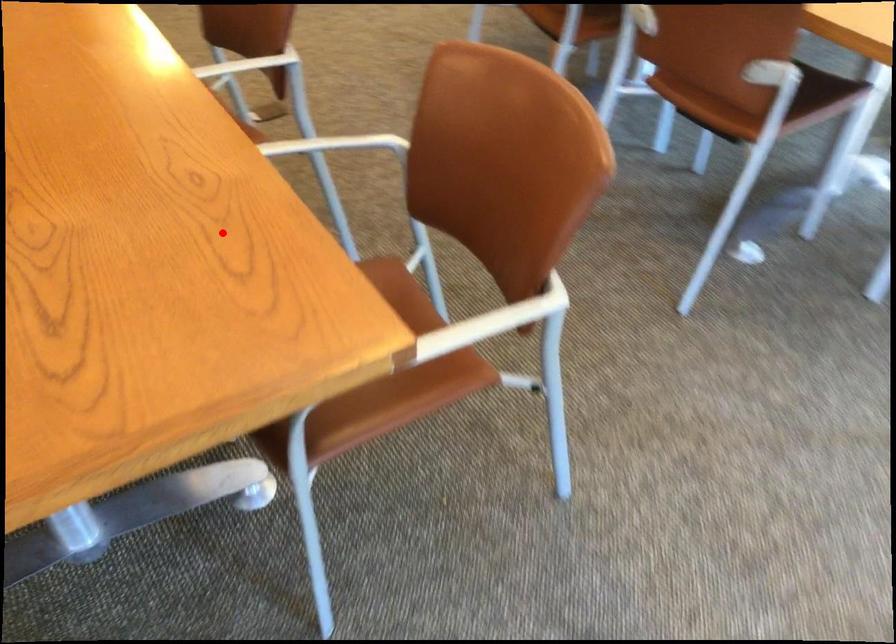
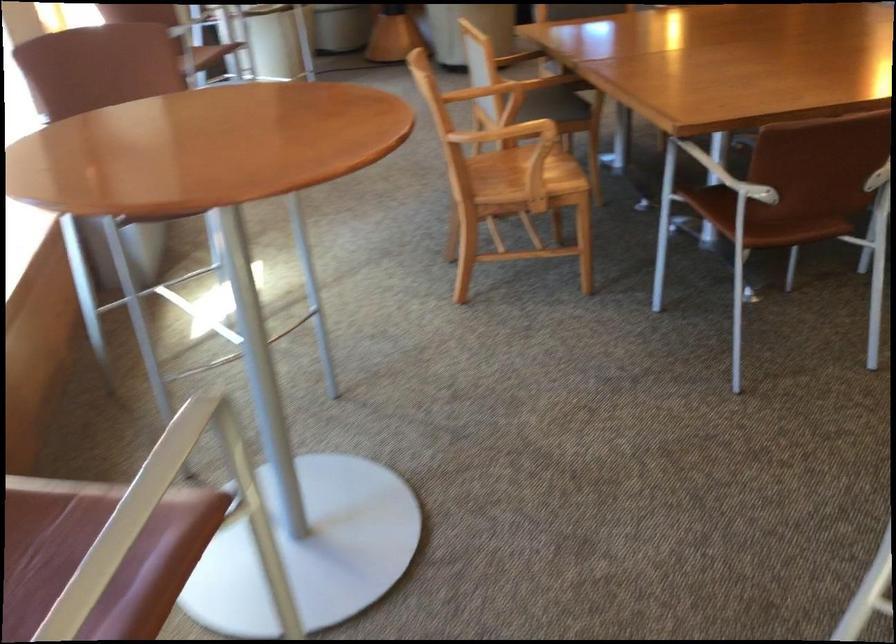
Question: I am providing you with two images of the same scene from different viewpoints. In image1, a red point is highlighted. Considering the same 3D point in image2, which of the following is correct?

Choices:
 (A) It is closer
 (B) It is farther

Answer: (B)